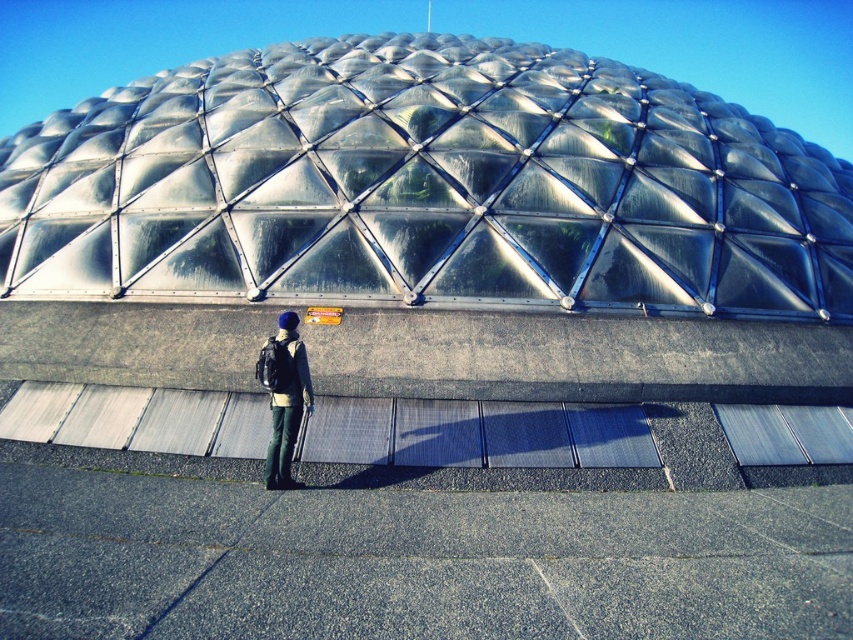
You are the person in the image standing near the metallic silver dome at upper center and the dark blue fabric backpack at center. You want to take a photo of the dome with your phone. Since the dome is taller than your backpack, where should you position yourself to ensure the entire dome fits in the frame?

Since the metallic silver dome at upper center is taller than the dark blue fabric backpack at center, you should move further away from the dome to capture its full height in the photo.

You are standing in front of the geodesic dome and notice two points on its surface. The first point is located at coordinates point (285, 68) and the second at point (293, 417). If you were to walk towards the dome, which point would appear closer to you as you approach?

Point (285, 68) is further to the viewer than point (293, 417), so as you walk towards the dome, point (285, 68) will appear closer to you compared to point (293, 417).

You are the person in the image holding a small object in your right hand. You want to take a photo of the metallic silver dome at upper center without including the dark blue fabric backpack at center in the frame. Is it possible to do so given their positions?

Yes, because the metallic silver dome at upper center is closer to you than the dark blue fabric backpack at center, so you can angle your camera to capture the dome while keeping the backpack out of the shot.